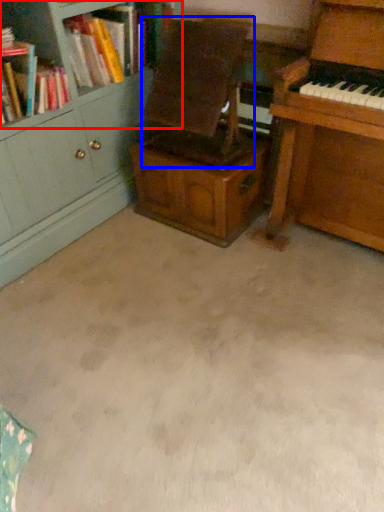
Question: Which object is further to the camera taking this photo, bookcase (highlighted by a red box) or armchair (highlighted by a blue box)?

Choices:
 (A) bookcase
 (B) armchair

Answer: (A)